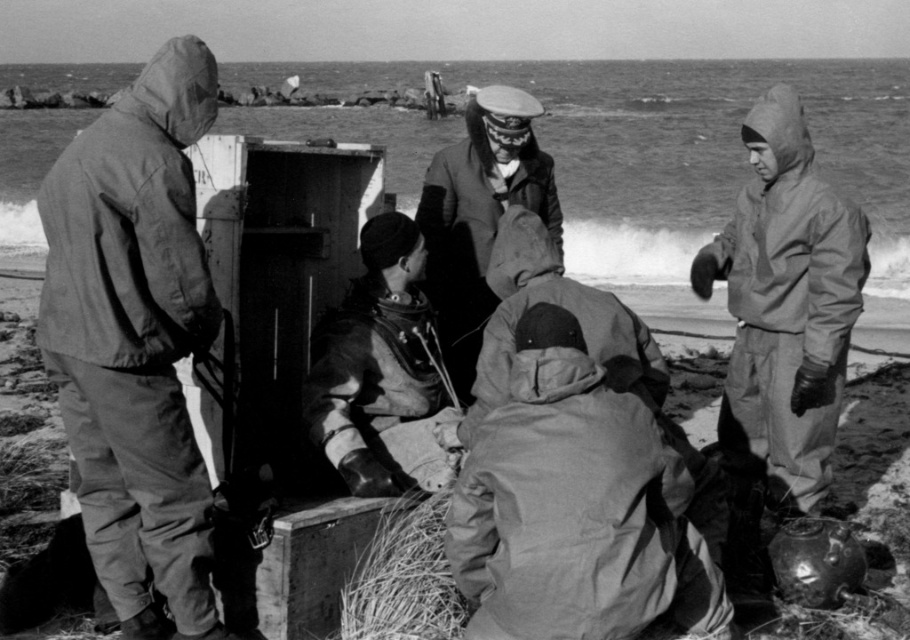
Looking at this image, based on the scene description, can you determine if the smooth leather jacket at center is wider than the fuzzy straw at lower center?

The smooth leather jacket at center might be wider than fuzzy straw at lower center according to the description.

You are a photographer standing near the camera in this cold beach scene. You want to take a photo of the matte gray jumpsuit at right without moving the camera. Can you do it?

The matte gray jumpsuit at right and camera are 4.91 meters apart from each other, so yes, the photographer can take a photo of the matte gray jumpsuit at right without moving the camera since the distance is within a typical camera range.

You are standing on the beach in the scene and want to move from the fuzzy straw at lower center to the matte gray jumpsuit at right. Which direction should you face to walk directly towards it?

You should face to the right because the matte gray jumpsuit at right is located to the right of the fuzzy straw at lower center.